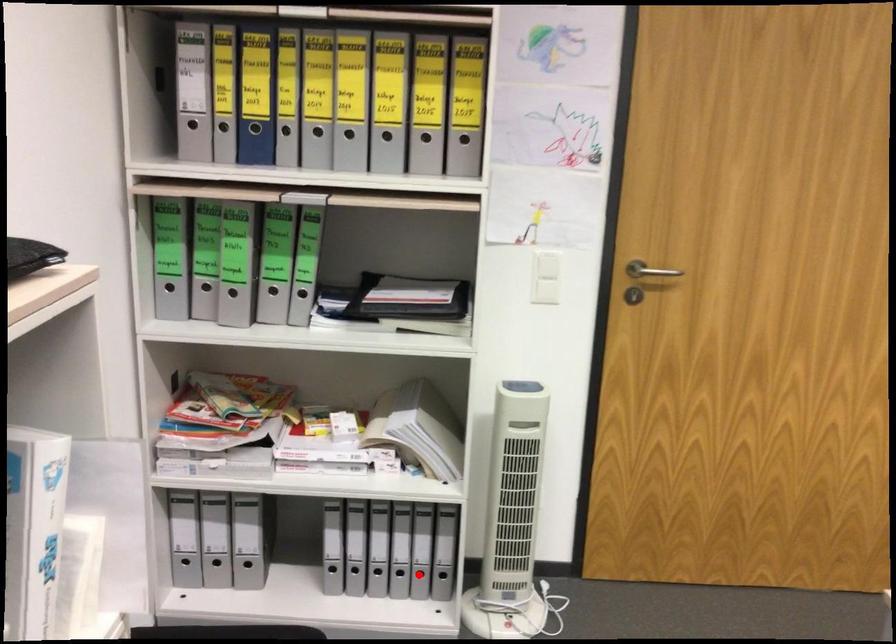
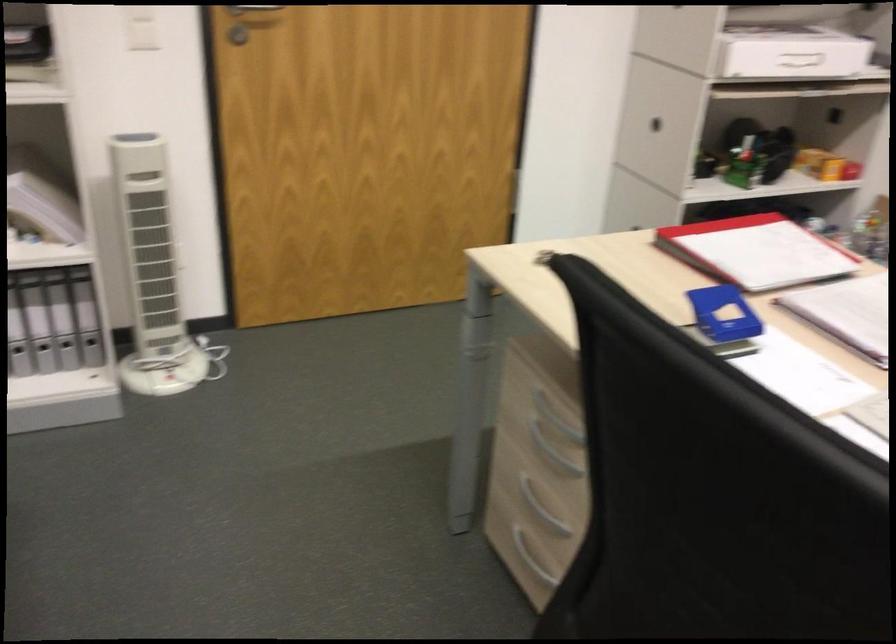
Locate, in the second image, the point that corresponds to the highlighted location in the first image.

(65, 344)